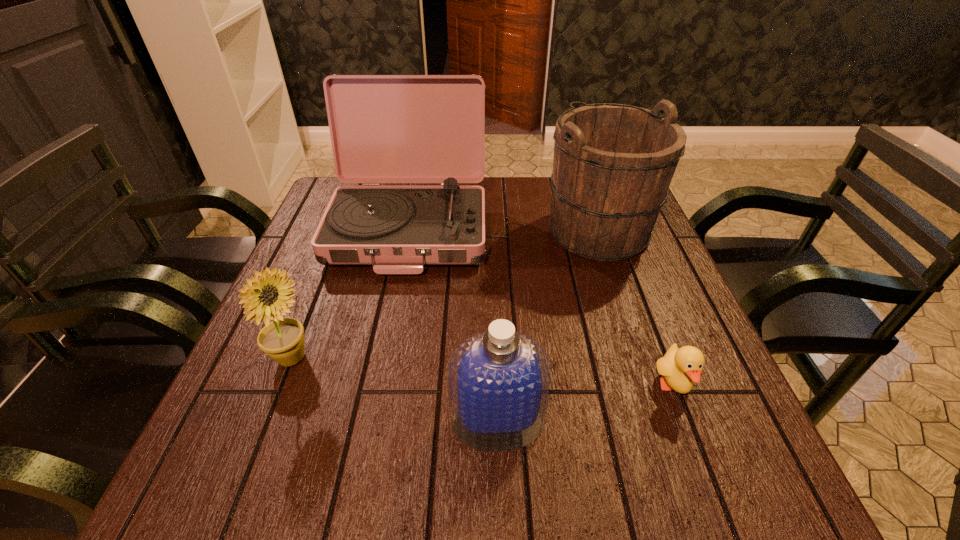
You are a GUI agent. You are given a task and a screenshot of the screen. Output one action in this format:
    pyautogui.click(x=<x>, y=<y>)
    Task: Click on the unoccupied position between the sunflower and the cleansing agent
    This screenshot has height=540, width=960.
    Given the screenshot: What is the action you would take?
    395,390

Locate an element on the screen. The image size is (960, 540). the closest object to the bucket is located at coordinates (384, 128).

Identify the location of object that is the nearest to the duckling. Image resolution: width=960 pixels, height=540 pixels. (499, 381).

Identify the location of free spot that satisfies the following two spatial constraints: 1. with the lid open on the record player; 2. on the right side of the bucket. (409, 230).

Identify the location of free spot that satisfies the following two spatial constraints: 1. with the lid open on the record player; 2. on the face of the sunflower. (383, 359).

Where is `free space in the image that satisfies the following two spatial constraints: 1. with the lid open on the record player; 2. on the right side of the cleansing agent`? The height and width of the screenshot is (540, 960). free space in the image that satisfies the following two spatial constraints: 1. with the lid open on the record player; 2. on the right side of the cleansing agent is located at coordinates (371, 422).

Find the location of a particular element. This screenshot has width=960, height=540. vacant space that satisfies the following two spatial constraints: 1. with the lid open on the record player; 2. on the face of the sunflower is located at coordinates (383, 359).

I want to click on free spot that satisfies the following two spatial constraints: 1. on the face of the sunflower; 2. on the right side of the cleansing agent, so click(x=267, y=422).